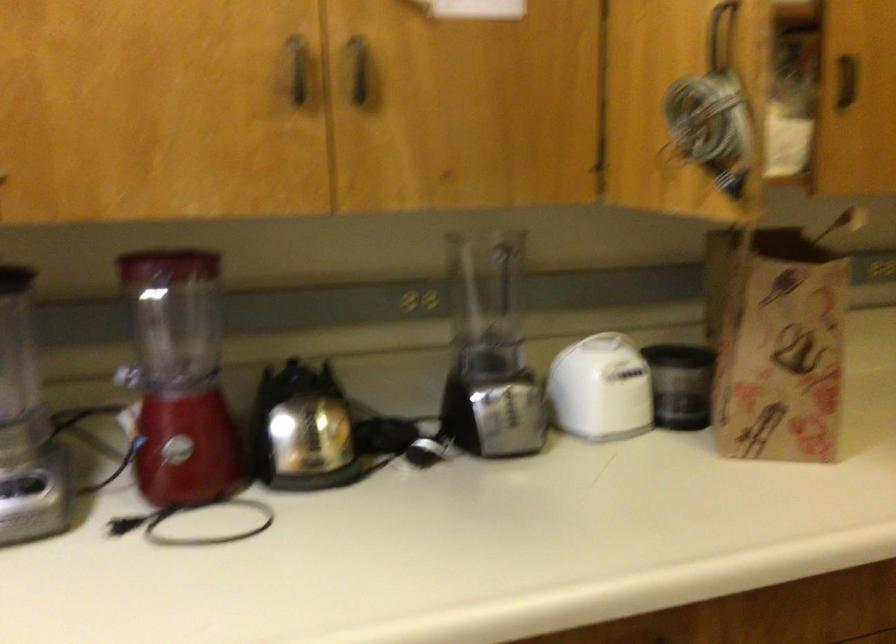
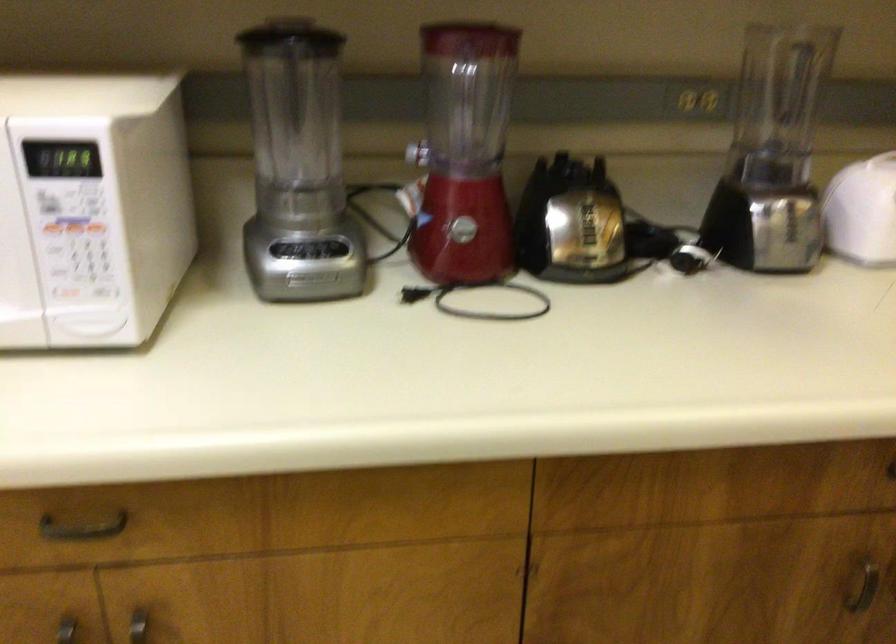
Question: Based on the continuous images, in which direction is the camera rotating? Reply with the corresponding letter.

Choices:
 (A) Left
 (B) Right
 (C) Up
 (D) Down

Answer: (D)